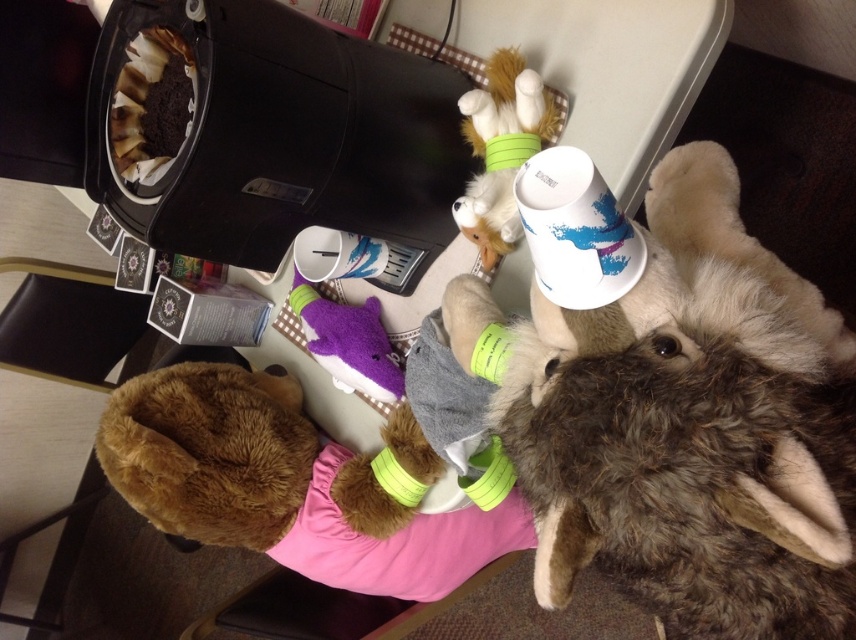
You are a photographer trying to capture a photo of the fluffy brown plush at upper right and the fuzzy yellow toy at upper center. Which one should you adjust your camera to focus on first if you want to ensure both are in the frame?

You should focus on the fuzzy yellow toy at upper center first because the fluffy brown plush at upper right is to its right side, so adjusting the camera to include both would start from the leftmost object.

What is located at the coordinate point (501,148) in the image?

The fuzzy yellow toy at upper center is located at point (501,148).